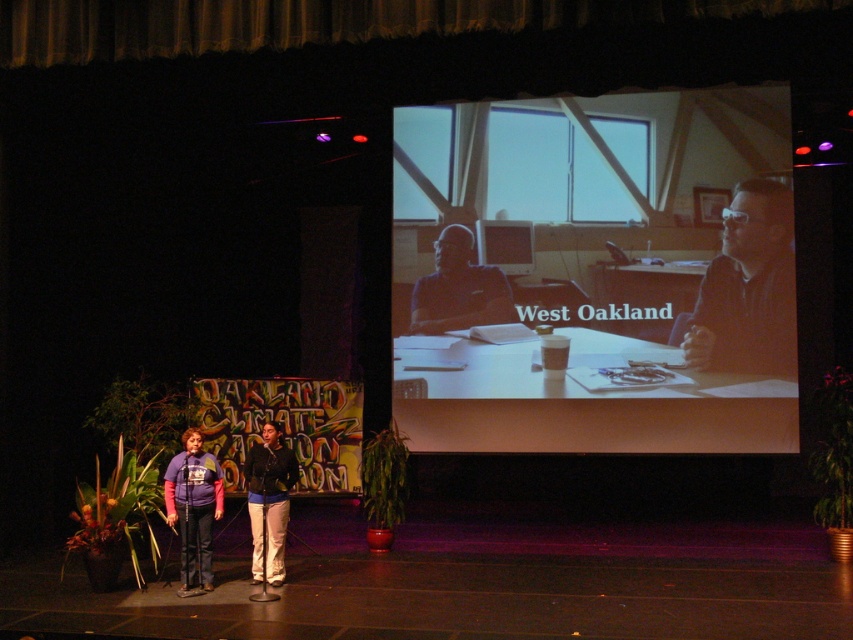
You are an event photographer who needs to capture a clear shot of both the velvet gold curtain at upper center and the purple fleece jacket at center. Based on their positions, which object is located to the right of the other?

The velvet gold curtain at upper center is positioned on the right side of purple fleece jacket at center.

You are an event organizer who needs to ensure that the two speakers on stage have equal visibility. Given the purple fleece jacket at center and the dark blue sweater at center, which speaker might need to stand on a small platform to appear taller? Explain your reasoning based on their clothing sizes.

The purple fleece jacket at center is smaller than the dark blue sweater at center. Since the purple fleece jacket at center is smaller, the speaker wearing it might need to stand on a small platform to appear taller and ensure equal visibility with the other speaker wearing the larger dark blue sweater at center.

Looking at this image, you are an event photographer who needs to position a spotlight on the matte black shirt at center and the purple fleece jacket at center. Based on the stage setup, which one is positioned to the right of the other?

The matte black shirt at center is to the right of the purple fleece jacket at center.